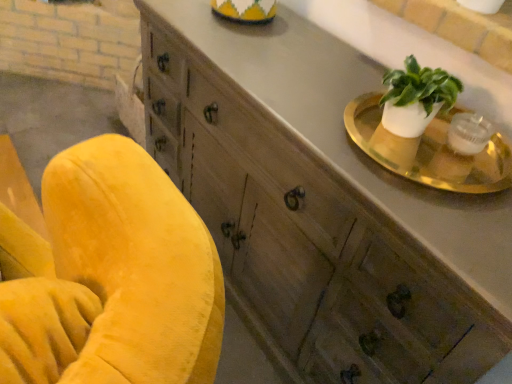
Where is `gold metallic tray at upper right`? The height and width of the screenshot is (384, 512). gold metallic tray at upper right is located at coordinates click(x=432, y=150).

This screenshot has width=512, height=384. What do you see at coordinates (432, 150) in the screenshot?
I see `gold metallic tray at upper right` at bounding box center [432, 150].

Find the location of a particular element. The height and width of the screenshot is (384, 512). wooden cabinet at upper right is located at coordinates (321, 204).

What is the approximate width of wooden cabinet at upper right?

wooden cabinet at upper right is 19.33 inches wide.

What do you see at coordinates (321, 204) in the screenshot? I see `wooden cabinet at upper right` at bounding box center [321, 204].

The image size is (512, 384). Find the location of `gold metallic tray at upper right`. gold metallic tray at upper right is located at coordinates (432, 150).

Between gold metallic tray at upper right and wooden cabinet at upper right, which one appears on the left side from the viewer's perspective?

Positioned to the left is wooden cabinet at upper right.

Between gold metallic tray at upper right and wooden cabinet at upper right, which one is positioned in front?

wooden cabinet at upper right.

Is point (354, 126) farther from viewer compared to point (373, 72)?

No, it is in front of (373, 72).

From the image's perspective, is gold metallic tray at upper right below wooden cabinet at upper right?

Actually, gold metallic tray at upper right appears above wooden cabinet at upper right in the image.

From a real-world perspective, is gold metallic tray at upper right physically below wooden cabinet at upper right?

No.

Considering the sizes of objects gold metallic tray at upper right and wooden cabinet at upper right in the image provided, who is wider, gold metallic tray at upper right or wooden cabinet at upper right?

wooden cabinet at upper right.

Between gold metallic tray at upper right and wooden cabinet at upper right, which one has less height?

With less height is gold metallic tray at upper right.

In the scene shown: Considering the sizes of objects gold metallic tray at upper right and wooden cabinet at upper right in the image provided, who is bigger, gold metallic tray at upper right or wooden cabinet at upper right?

wooden cabinet at upper right.

Choose the correct answer: Is gold metallic tray at upper right inside wooden cabinet at upper right or outside it?

gold metallic tray at upper right exists entirely within wooden cabinet at upper right.

Is gold metallic tray at upper right not close to wooden cabinet at upper right?

No.

Is gold metallic tray at upper right turned away from wooden cabinet at upper right?

No, gold metallic tray at upper right is not facing the opposite direction of wooden cabinet at upper right.

How many degrees apart are the facing directions of gold metallic tray at upper right and wooden cabinet at upper right?

gold metallic tray at upper right and wooden cabinet at upper right are facing 1.62 degrees away from each other.

Measure the distance from gold metallic tray at upper right to wooden cabinet at upper right.

gold metallic tray at upper right and wooden cabinet at upper right are 11.38 inches apart from each other.

Where is `cabinetry located on the left of gold metallic tray at upper right`? cabinetry located on the left of gold metallic tray at upper right is located at coordinates (321, 204).

Is wooden cabinet at upper right to the left of gold metallic tray at upper right from the viewer's perspective?

Indeed, wooden cabinet at upper right is positioned on the left side of gold metallic tray at upper right.

Which object is further away from the camera, wooden cabinet at upper right or gold metallic tray at upper right?

gold metallic tray at upper right is more distant.

Which point is more forward, (x=286, y=86) or (x=493, y=164)?

The point (x=493, y=164) is more forward.

Based on the photo, from the image's perspective, is wooden cabinet at upper right above or below gold metallic tray at upper right?

Clearly, from the image's perspective, wooden cabinet at upper right is below gold metallic tray at upper right.

From a real-world perspective, is wooden cabinet at upper right above or below gold metallic tray at upper right?

From a real-world perspective, wooden cabinet at upper right is physically below gold metallic tray at upper right.

Considering the relative sizes of wooden cabinet at upper right and gold metallic tray at upper right in the image provided, is wooden cabinet at upper right wider than gold metallic tray at upper right?

Correct, the width of wooden cabinet at upper right exceeds that of gold metallic tray at upper right.

Considering the sizes of wooden cabinet at upper right and gold metallic tray at upper right in the image, is wooden cabinet at upper right taller or shorter than gold metallic tray at upper right?

Clearly, wooden cabinet at upper right is taller compared to gold metallic tray at upper right.

Considering the sizes of wooden cabinet at upper right and gold metallic tray at upper right in the image, is wooden cabinet at upper right bigger or smaller than gold metallic tray at upper right?

Considering their sizes, wooden cabinet at upper right takes up more space than gold metallic tray at upper right.

Would you say wooden cabinet at upper right is inside or outside gold metallic tray at upper right?

wooden cabinet at upper right is outside gold metallic tray at upper right.

Are wooden cabinet at upper right and gold metallic tray at upper right located far from each other?

That's not correct — wooden cabinet at upper right is a little close to gold metallic tray at upper right.

Is wooden cabinet at upper right aimed at gold metallic tray at upper right?

No.

Where is `round table that appears above the wooden cabinet at upper right (from a real-world perspective)`? The image size is (512, 384). round table that appears above the wooden cabinet at upper right (from a real-world perspective) is located at coordinates (432, 150).

Where is `round table behind the wooden cabinet at upper right`? This screenshot has width=512, height=384. round table behind the wooden cabinet at upper right is located at coordinates (432, 150).

Identify the location of cabinetry that is under the gold metallic tray at upper right (from a real-world perspective). (321, 204).